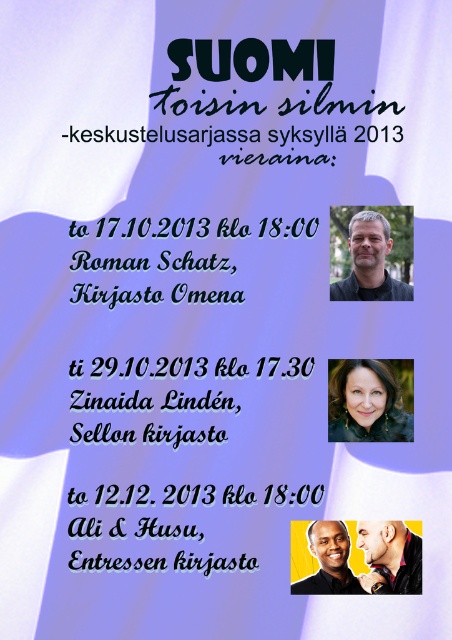
You are standing in front of the poster and want to touch both points mentioned. Which point should you reach for first, the point at coordinate [389,524] or the point at coordinate [335,563]?

You should reach for the point at coordinate [389,524] first because it is closer to you than the point at coordinate [335,563].